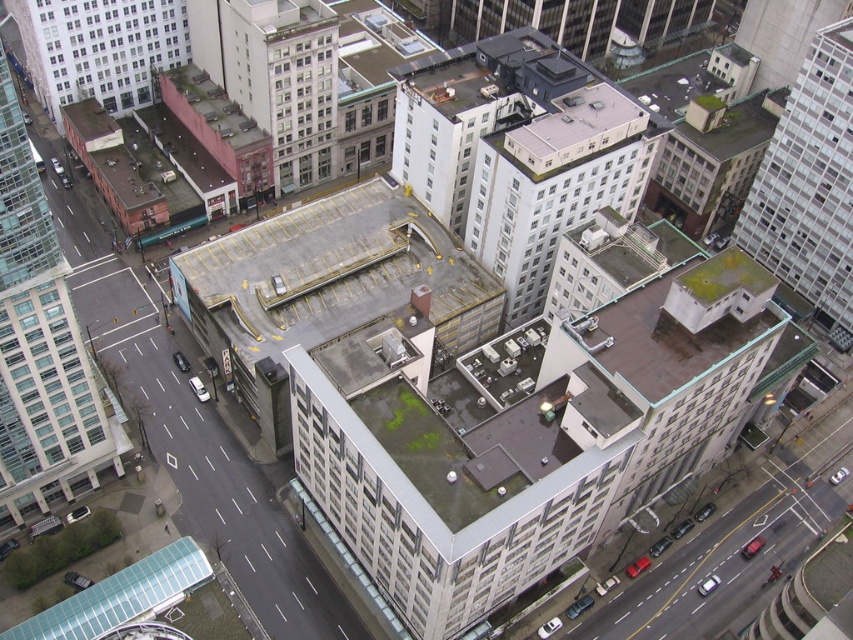
Question: In this image, where is glassy white skyscraper at left located relative to white matte building at center?

Choices:
 (A) below
 (B) above

Answer: (A)

Question: Among these points, which one is nearest to the camera?

Choices:
 (A) (827, 116)
 (B) (26, 369)

Answer: (B)

Question: Which of the following is the closest to the observer?

Choices:
 (A) (544, 212)
 (B) (827, 237)

Answer: (A)

Question: Which is nearer to the light pink concrete building at upper left?

Choices:
 (A) white glass building at upper right
 (B) white matte building at center
 (C) glassy white skyscraper at left

Answer: (C)

Question: Is white matte building at center above white glass building at upper right?

Choices:
 (A) no
 (B) yes

Answer: (A)

Question: Does glassy white skyscraper at left have a larger size compared to light pink concrete building at upper left?

Choices:
 (A) yes
 (B) no

Answer: (A)